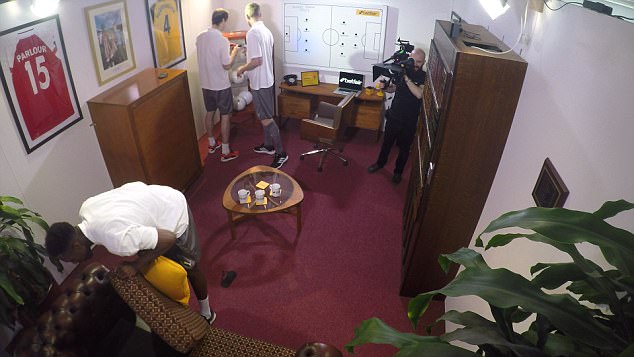
At what (x,y) coordinates should I click in order to perform the action: click on plaque. Please return your answer as a coordinate pair (x, y). The width and height of the screenshot is (634, 357). Looking at the image, I should click on (558, 188).